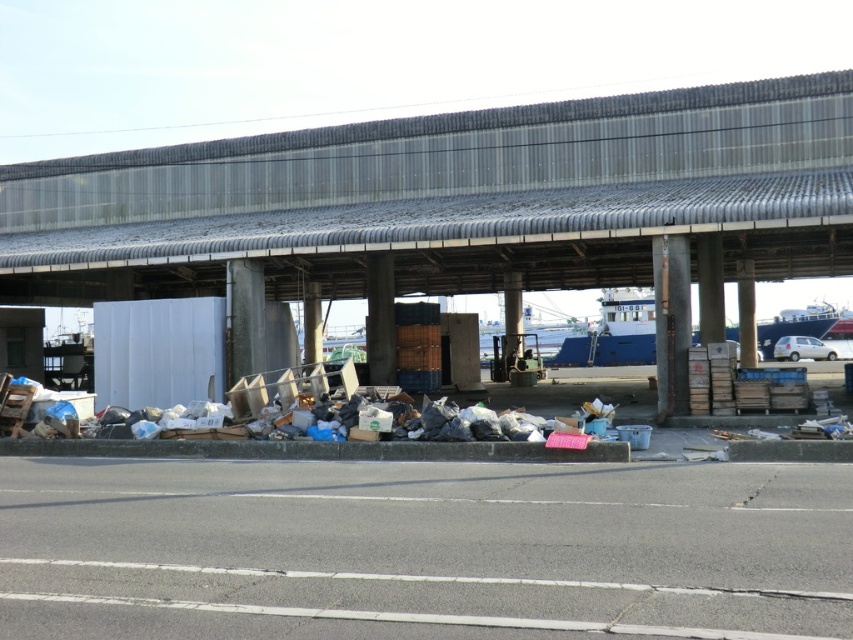
Is point (21, 244) positioned behind point (805, 348)?

No, it is not.

From the picture: Who is more distant from viewer, (438,195) or (778,340)?

Positioned behind is point (778,340).

Between point (497, 248) and point (817, 349), which one is positioned in front?

Point (497, 248) is in front.

Locate an element on the screen. The width and height of the screenshot is (853, 640). metallic gray overpass at upper center is located at coordinates (450, 198).